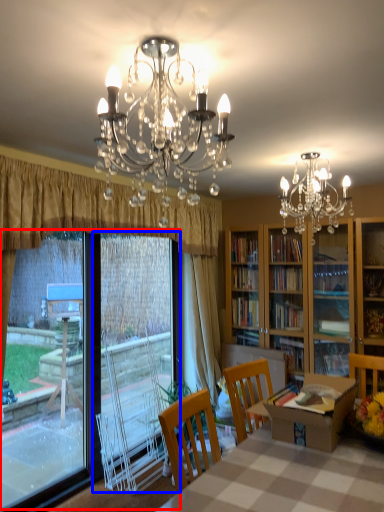
Question: Which object is closer to the camera taking this photo, window screen (highlighted by a red box) or screen door (highlighted by a blue box)?

Choices:
 (A) window screen
 (B) screen door

Answer: (A)